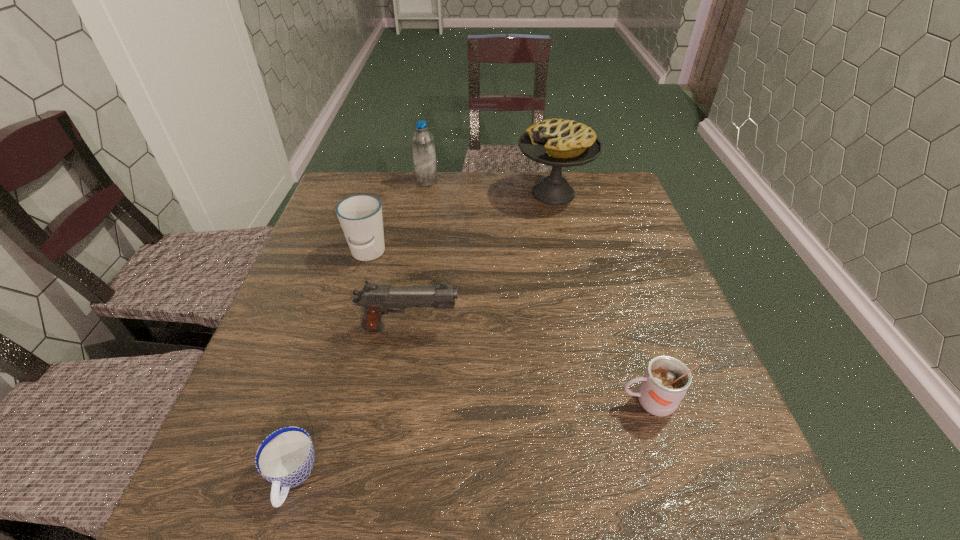
Locate an element on the screen. pie is located at coordinates (559, 143).

Locate an element on the screen. This screenshot has width=960, height=540. water bottle is located at coordinates (423, 145).

This screenshot has width=960, height=540. I want to click on the farthest cup, so click(360, 216).

At what (x,y) coordinates should I click in order to perform the action: click on the third farthest object. Please return your answer as a coordinate pair (x, y). Looking at the image, I should click on (360, 216).

Image resolution: width=960 pixels, height=540 pixels. What are the coordinates of `gun` in the screenshot? It's located at (376, 300).

You are a GUI agent. You are given a task and a screenshot of the screen. Output one action in this format:
    pyautogui.click(x=<x>, y=<y>)
    Task: Click on the fifth farthest object
    
    Given the screenshot: What is the action you would take?
    pyautogui.click(x=666, y=380)

Locate an element on the screen. The height and width of the screenshot is (540, 960). the rightmost cup is located at coordinates (666, 380).

Image resolution: width=960 pixels, height=540 pixels. What are the coordinates of `the nearest cup` in the screenshot? It's located at (285, 458).

The height and width of the screenshot is (540, 960). I want to click on the shortest cup, so click(x=285, y=458).

This screenshot has width=960, height=540. Identify the location of vacant space positioned 0.230m on the cut side of the pie. (439, 193).